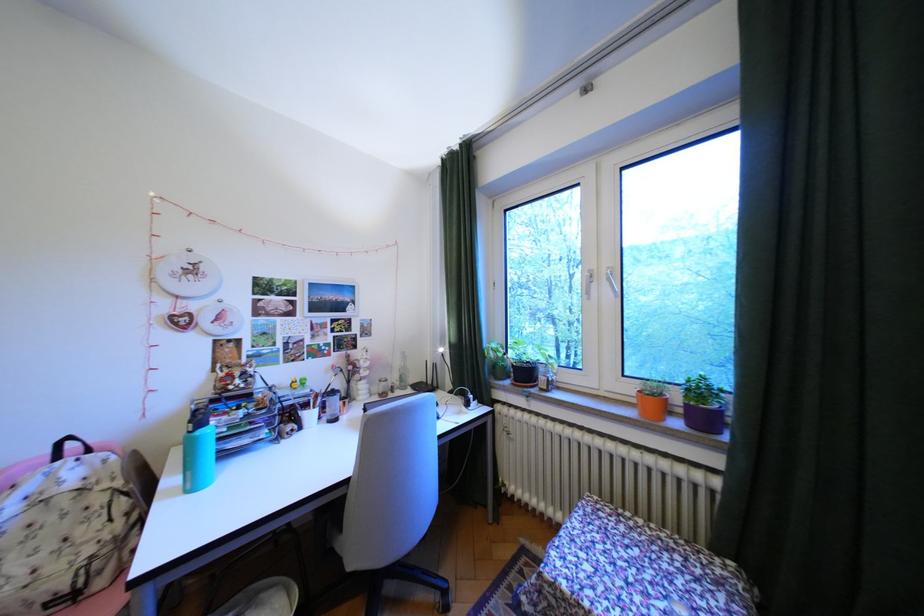
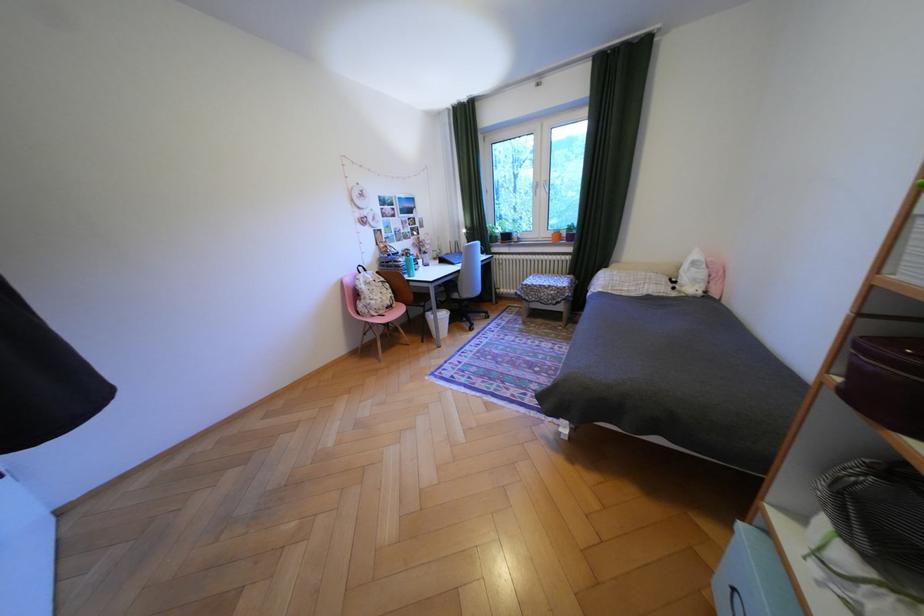
Locate, in the second image, the point that corresponds to point 605,285 in the first image.

(551, 190)